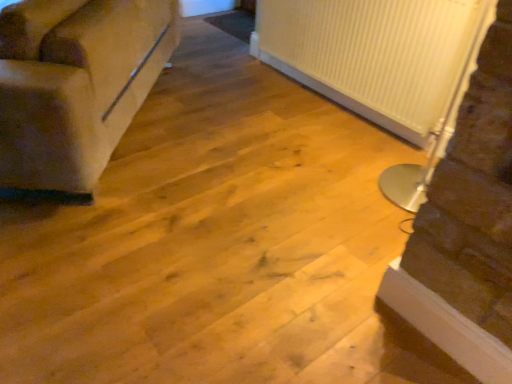
Question: Do you think suede-like beige couch at left is within white ribbed radiator at right, or outside of it?

Choices:
 (A) inside
 (B) outside

Answer: (B)

Question: Looking at the image, does suede-like beige couch at left seem bigger or smaller compared to white ribbed radiator at right?

Choices:
 (A) small
 (B) big

Answer: (B)

Question: Estimate the real-world distances between objects in this image. Which object is farther from the white ribbed radiator at right?

Choices:
 (A) white ribbed radiator at upper right
 (B) suede-like beige couch at left

Answer: (B)

Question: Based on their relative distances, which object is farther from the white ribbed radiator at upper right?

Choices:
 (A) white ribbed radiator at right
 (B) suede-like beige couch at left

Answer: (B)